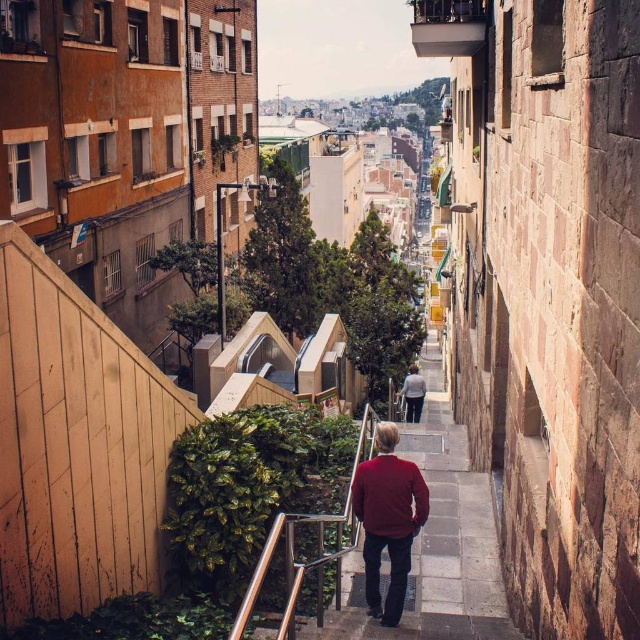
Question: Does matte red sweater at center have a lesser width compared to light blue denim jacket at center?

Choices:
 (A) no
 (B) yes

Answer: (A)

Question: Which point is farther to the camera?

Choices:
 (A) light blue denim jacket at center
 (B) matte red sweater at center

Answer: (A)

Question: Is matte red sweater at center to the right of light blue denim jacket at center from the viewer's perspective?

Choices:
 (A) yes
 (B) no

Answer: (B)

Question: Which point is closer to the camera?

Choices:
 (A) (422, 380)
 (B) (397, 461)

Answer: (B)

Question: Does matte red sweater at center appear on the right side of light blue denim jacket at center?

Choices:
 (A) yes
 (B) no

Answer: (B)